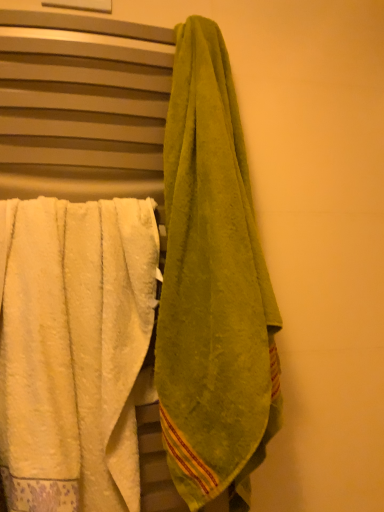
Question: Can we say green cotton towel at right lies outside green terry cloth towel at right, which appears as the 1th towel when viewed from the right?

Choices:
 (A) yes
 (B) no

Answer: (A)

Question: Can you confirm if green cotton towel at right is positioned to the left of green terry cloth towel at right, which appears as the 1th towel when viewed from the right?

Choices:
 (A) no
 (B) yes

Answer: (B)

Question: From the image's perspective, is green cotton towel at right above green terry cloth towel at right, which appears as the 1th towel when viewed from the right?

Choices:
 (A) yes
 (B) no

Answer: (B)

Question: Is green cotton towel at right surrounding green terry cloth towel at right, positioned as the 2th towel in left-to-right order?

Choices:
 (A) yes
 (B) no

Answer: (B)

Question: Is green cotton towel at right turned away from green terry cloth towel at right, positioned as the 2th towel in left-to-right order?

Choices:
 (A) yes
 (B) no

Answer: (B)

Question: Is green cotton towel at right shorter than green terry cloth towel at right, positioned as the 2th towel in left-to-right order?

Choices:
 (A) yes
 (B) no

Answer: (B)

Question: From a real-world perspective, is green terry cloth towel at right, which appears as the 1th towel when viewed from the right, below white fluffy towel at left, the 2th towel viewed from the right?

Choices:
 (A) no
 (B) yes

Answer: (A)

Question: Considering the relative positions of green terry cloth towel at right, which appears as the 1th towel when viewed from the right, and white fluffy towel at left, marked as the 1th towel in a left-to-right arrangement, in the image provided, is green terry cloth towel at right, which appears as the 1th towel when viewed from the right, behind white fluffy towel at left, marked as the 1th towel in a left-to-right arrangement,?

Choices:
 (A) yes
 (B) no

Answer: (B)

Question: Would you consider green terry cloth towel at right, which appears as the 1th towel when viewed from the right, to be distant from white fluffy towel at left, marked as the 1th towel in a left-to-right arrangement?

Choices:
 (A) no
 (B) yes

Answer: (A)

Question: From the image's perspective, is green terry cloth towel at right, positioned as the 2th towel in left-to-right order, below white fluffy towel at left, marked as the 1th towel in a left-to-right arrangement?

Choices:
 (A) no
 (B) yes

Answer: (A)

Question: Is green terry cloth towel at right, positioned as the 2th towel in left-to-right order, taller than white fluffy towel at left, the 2th towel viewed from the right?

Choices:
 (A) no
 (B) yes

Answer: (B)

Question: Considering the relative sizes of green terry cloth towel at right, positioned as the 2th towel in left-to-right order, and white fluffy towel at left, marked as the 1th towel in a left-to-right arrangement, in the image provided, is green terry cloth towel at right, positioned as the 2th towel in left-to-right order, bigger than white fluffy towel at left, marked as the 1th towel in a left-to-right arrangement,?

Choices:
 (A) no
 (B) yes

Answer: (B)

Question: Is green terry cloth towel at right, positioned as the 2th towel in left-to-right order, smaller than green cotton towel at right?

Choices:
 (A) no
 (B) yes

Answer: (B)